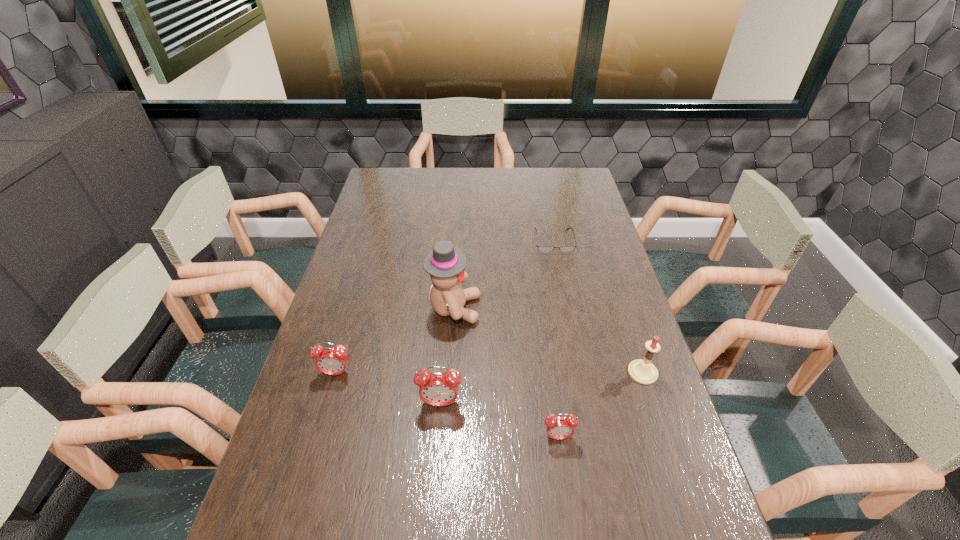
What are the coordinates of `free location that satisfies the following two spatial constraints: 1. on the front-facing side of the spectacles; 2. on the left side of the rightmost object` in the screenshot? It's located at (580, 373).

Where is `free space that satisfies the following two spatial constraints: 1. on the front-facing side of the tallest object; 2. on the face of the second alarm clock from right to left`? This screenshot has height=540, width=960. free space that satisfies the following two spatial constraints: 1. on the front-facing side of the tallest object; 2. on the face of the second alarm clock from right to left is located at coordinates (448, 403).

Find the location of a particular element. The height and width of the screenshot is (540, 960). vacant region that satisfies the following two spatial constraints: 1. on the front-facing side of the rightmost object; 2. on the right side of the shortest object is located at coordinates (580, 373).

Identify the location of vacant area that satisfies the following two spatial constraints: 1. on the front-facing side of the rag_doll; 2. on the face of the third shortest object. The height and width of the screenshot is (540, 960). (450, 373).

The width and height of the screenshot is (960, 540). Identify the location of free space that satisfies the following two spatial constraints: 1. on the front-facing side of the rightmost object; 2. on the left side of the rag_doll. click(450, 373).

Find the location of a particular element. Image resolution: width=960 pixels, height=540 pixels. free space that satisfies the following two spatial constraints: 1. on the front-facing side of the farthest object; 2. on the left side of the candle is located at coordinates (580, 373).